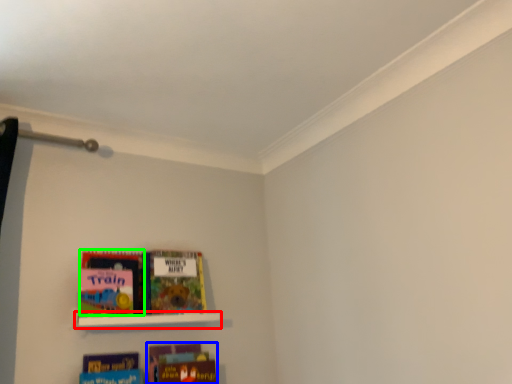
Question: Which is farther away from shelf (highlighted by a red box)? book (highlighted by a blue box) or book (highlighted by a green box)?

Choices:
 (A) book
 (B) book

Answer: (A)